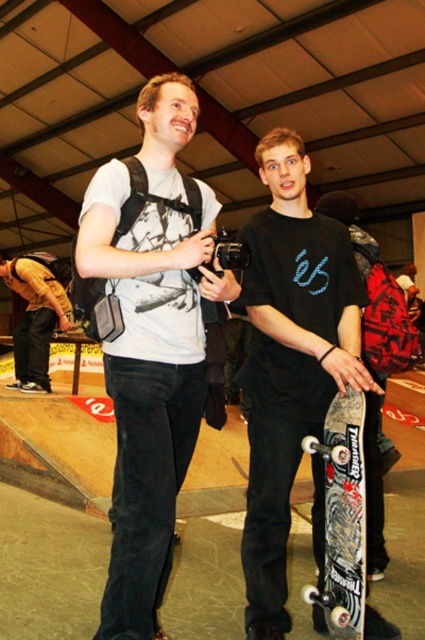
You are a photographer at the skateboarding event. You need to capture a photo that includes both the black textured skateboard at lower right and the yellow casual jacket at left. Since the skateboard is narrower than the jacket, where should you position the camera to ensure both objects are fully visible in the frame?

Since the black textured skateboard at lower right has a lesser width compared to the yellow casual jacket at left, you should position the camera so that the wider yellow casual jacket at left is centered or placed in a position that allows its full width to be captured while still including the narrower skateboard in the frame.

You are a photographer at the skateboarding event. You need to capture a photo of the black matte skateboard at center from your camera. The camera has a minimum focusing distance of 2 meters. Can you take the photo without moving closer?

The distance between the black matte skateboard at center and the camera is 2.10 meters, which is greater than the camera minimum focusing distance of 2 meters. Therefore, you can take the photo without moving closer.

You are a photographer at the skateboarding event. You want to take a photo of the black textured skateboard at lower right and the yellow casual jacket at left. Which object should you focus on first if you want to capture both in the same frame without moving the camera?

The black textured skateboard at lower right is in front of the yellow casual jacket at left, so you should focus on the skateboard first to ensure both are in focus since it is closer to the camera.